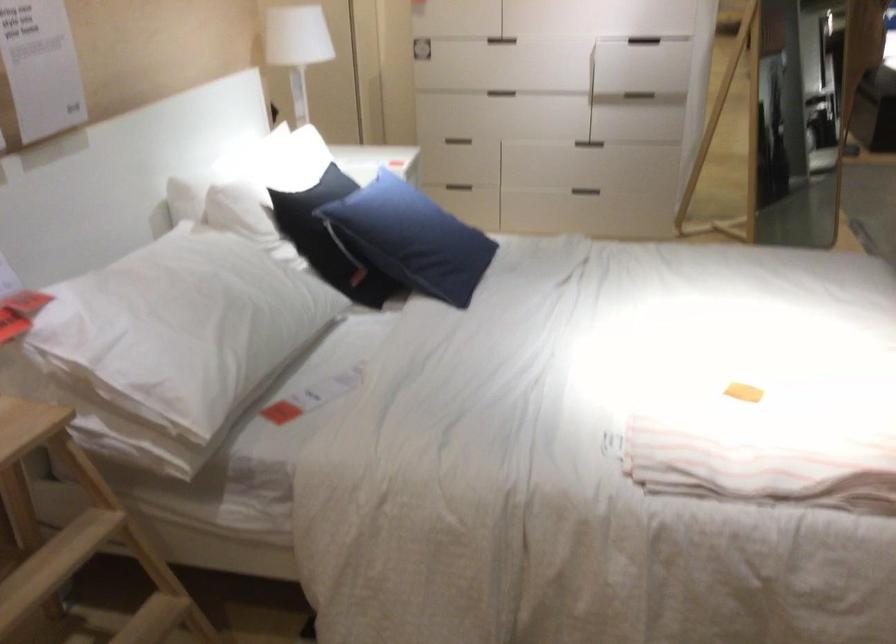
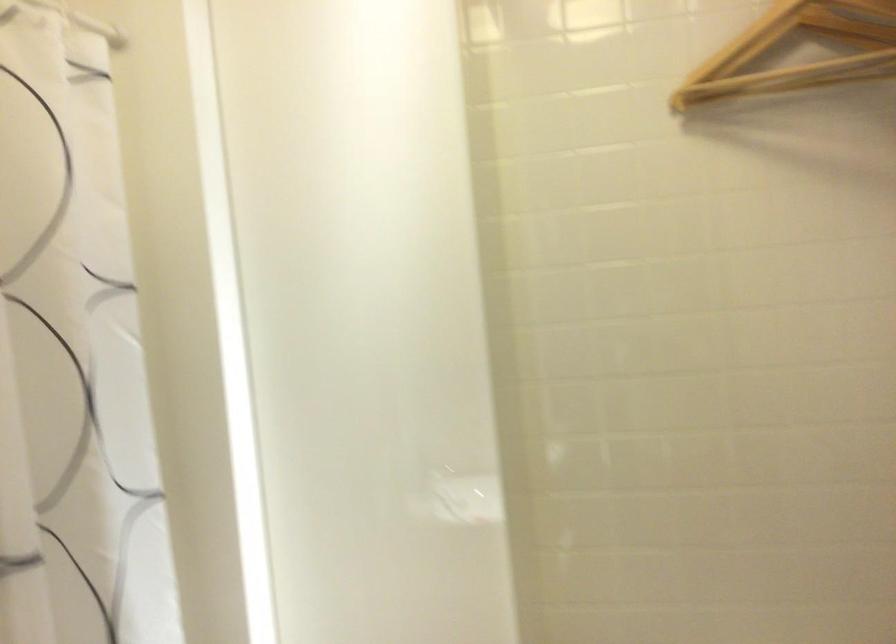
Based on the photo, what movement of the cameraman would produce the second image?

The cameraman moved toward left, forward.